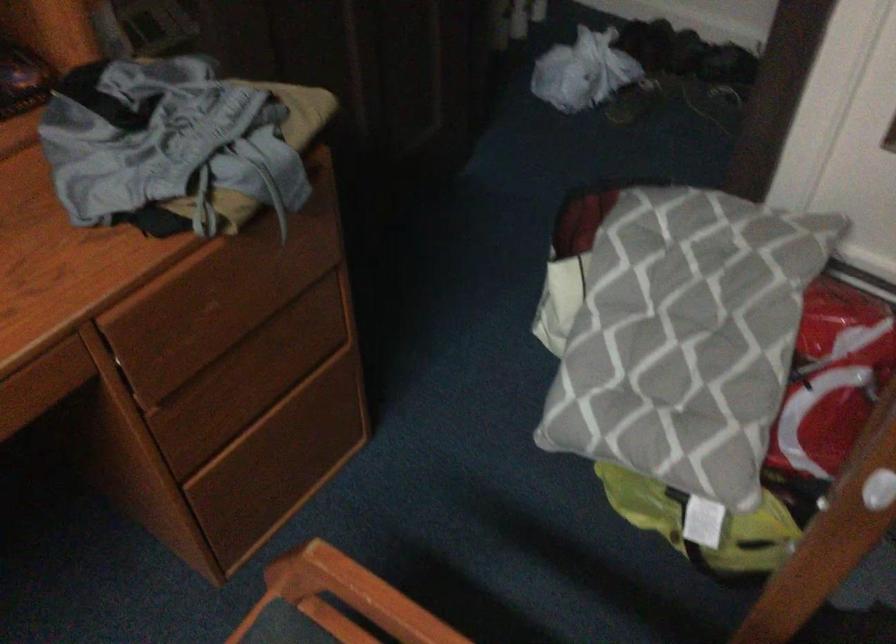
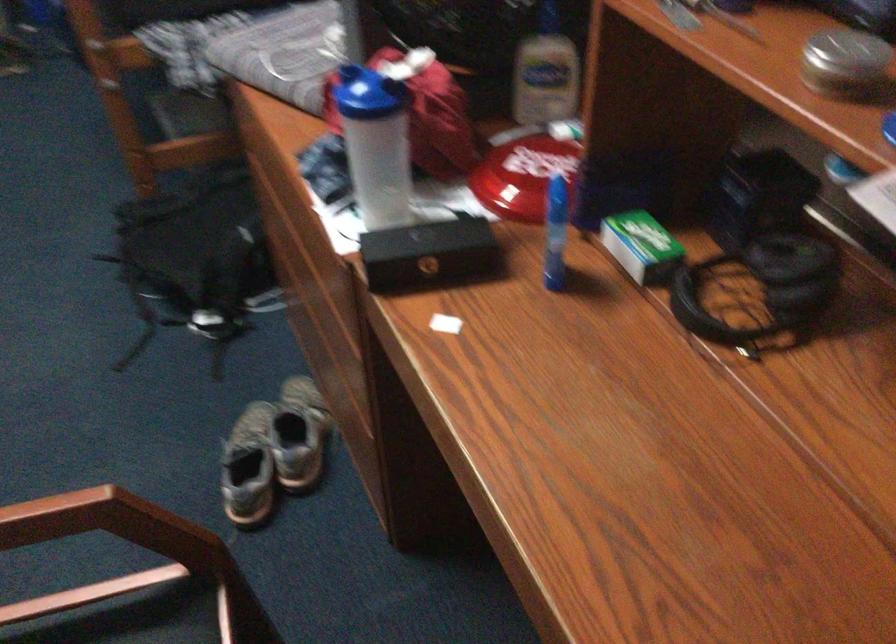
The images are taken continuously from a first-person perspective. In which direction is your viewpoint rotating?

The camera rotated toward left-down.